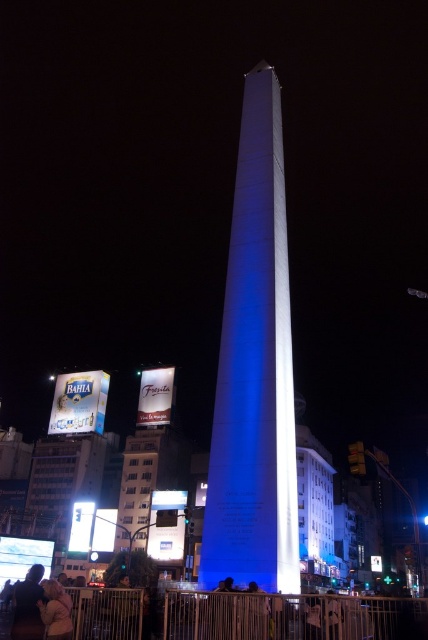
Is point (279, 467) closer to viewer compared to point (42, 589)?

That is False.

Which is below, white polished stone obelisk at center or matte black shirt at lower left?

matte black shirt at lower left

Who is more forward, (211, 456) or (29, 632)?

Point (29, 632) is more forward.

At what (x,y) coordinates should I click in order to perform the action: click on white polished stone obelisk at center. Please return your answer as a coordinate pair (x, y). The width and height of the screenshot is (428, 640). Looking at the image, I should click on (255, 369).

Does white polished stone obelisk at center appear on the right side of blonde hair at lower left?

Correct, you'll find white polished stone obelisk at center to the right of blonde hair at lower left.

Is point (253, 186) positioned in front of point (56, 616)?

No, (253, 186) is behind (56, 616).

Describe the element at coordinates (255, 369) in the screenshot. This screenshot has width=428, height=640. I see `white polished stone obelisk at center` at that location.

I want to click on white polished stone obelisk at center, so click(255, 369).

Who is shorter, matte black shirt at lower left or blonde hair at lower left?

blonde hair at lower left

Can you confirm if matte black shirt at lower left is positioned to the left of blonde hair at lower left?

Correct, you'll find matte black shirt at lower left to the left of blonde hair at lower left.

Does point (23, 620) come farther from viewer compared to point (56, 602)?

No, it is in front of (56, 602).

Where is `matte black shirt at lower left`? matte black shirt at lower left is located at coordinates (27, 605).